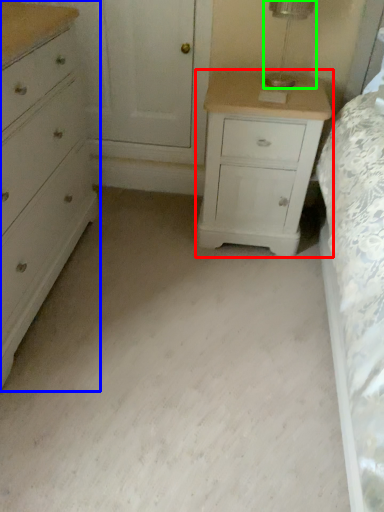
Question: Which object is the closest to the nightstand (highlighted by a red box)? Choose among these: chest of drawers (highlighted by a blue box) or table lamp (highlighted by a green box).

Choices:
 (A) chest of drawers
 (B) table lamp

Answer: (B)